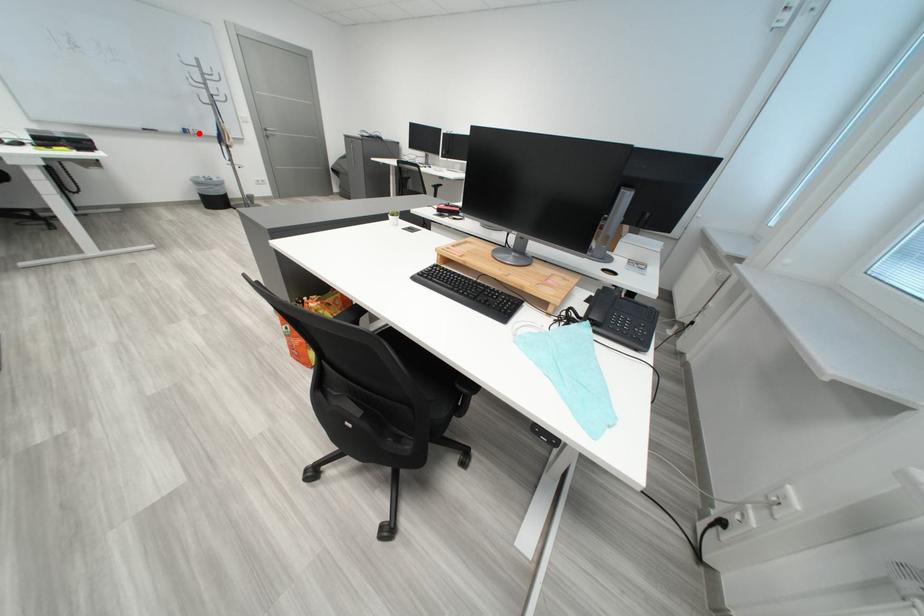
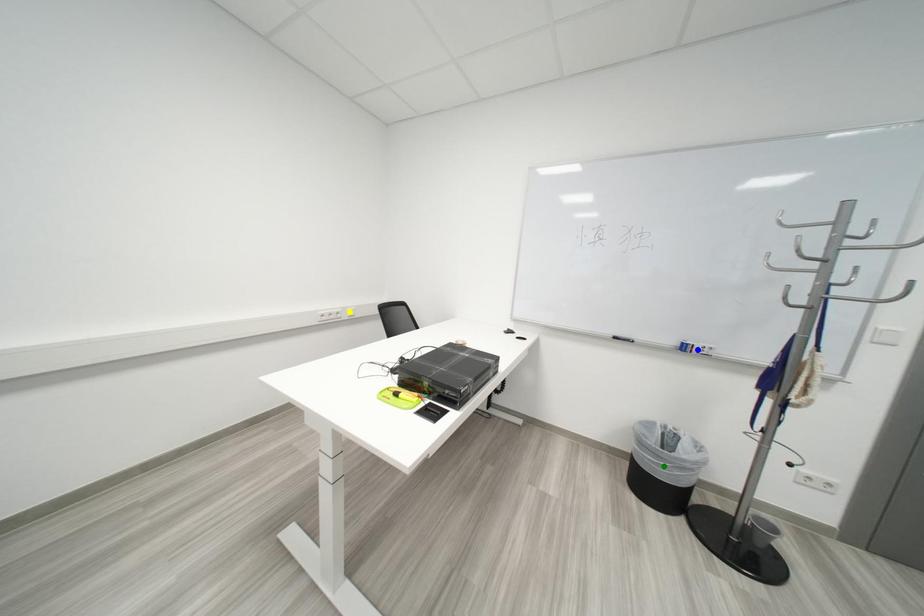
Question: I am providing you with two images of the same scene from different viewpoints. A red point is marked on the first image. You are given multiple points on the second image. Which point in image 2 is actually the same real-world point as the red point in image 1?

Choices:
 (A) green point
 (B) blue point
 (C) yellow point

Answer: (B)